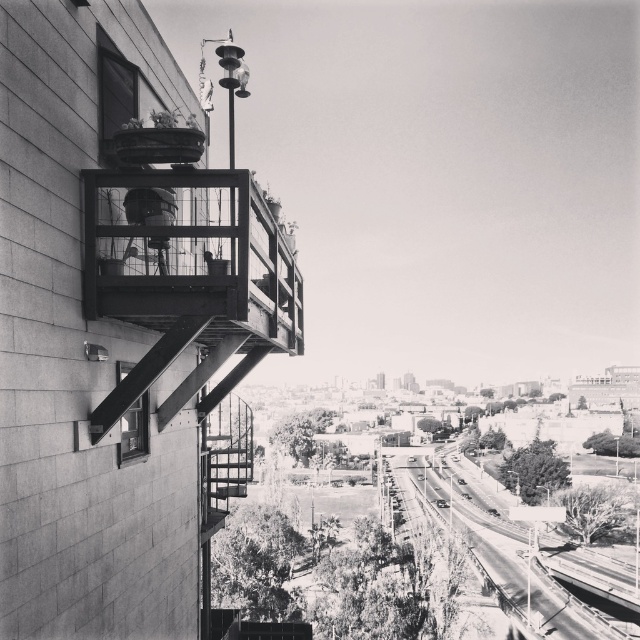
Which is below, wooden balcony at center or clear glass window at lower left?

clear glass window at lower left is below.

Between wooden balcony at center and clear glass window at lower left, which one appears on the left side from the viewer's perspective?

clear glass window at lower left

Is point (136, 276) farther from camera compared to point (134, 422)?

That is False.

Where is `wooden balcony at center`? This screenshot has width=640, height=640. wooden balcony at center is located at coordinates (188, 253).

Is point (580, 608) closer to camera compared to point (128, 449)?

No, (580, 608) is behind (128, 449).

Image resolution: width=640 pixels, height=640 pixels. What do you see at coordinates (513, 564) in the screenshot? I see `smooth asphalt road at lower center` at bounding box center [513, 564].

Which is behind, point (540, 557) or point (129, 436)?

The point (540, 557) is more distant.

Locate an element on the screen. This screenshot has height=640, width=640. smooth asphalt road at lower center is located at coordinates (513, 564).

Is point (300, 301) closer to viewer compared to point (528, 536)?

That is True.

In the scene shown: Is wooden balcony at center smaller than smooth asphalt road at lower center?

Yes.

The height and width of the screenshot is (640, 640). What do you see at coordinates (188, 253) in the screenshot?
I see `wooden balcony at center` at bounding box center [188, 253].

In order to click on wooden balcony at center in this screenshot , I will do `click(188, 253)`.